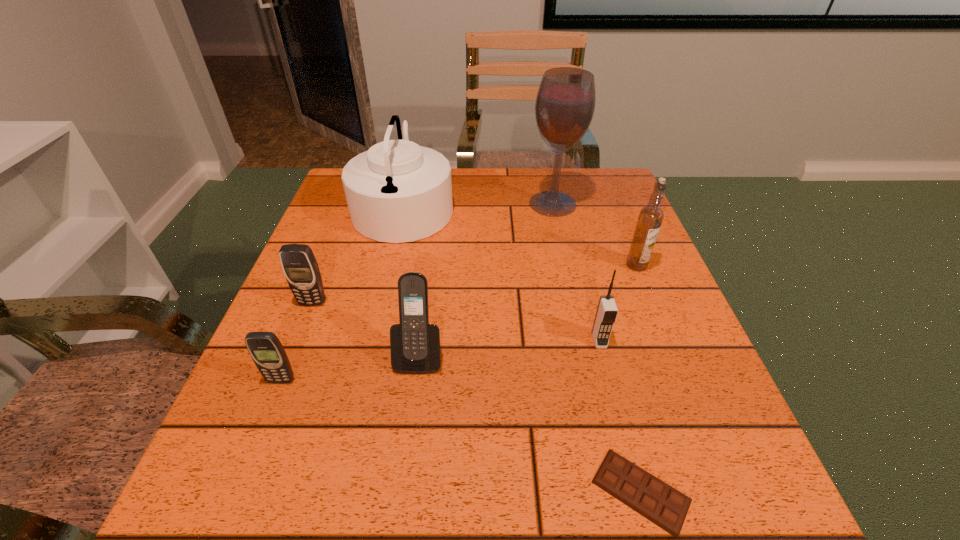
Find the location of a particular element. The image size is (960, 540). vacant area that satisfies the following two spatial constraints: 1. on the spout of the kettle; 2. on the screen of the nearest cellular telephone is located at coordinates (364, 381).